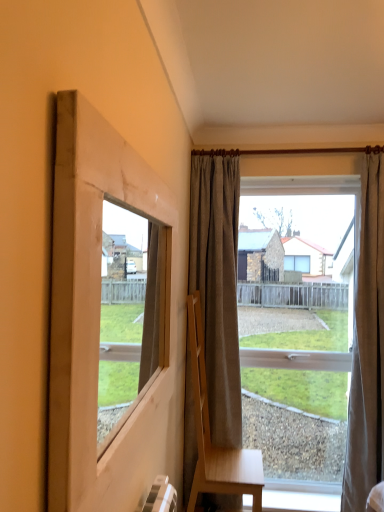
Question: Is clear glass window at center positioned in front of light brown wooden chair at center?

Choices:
 (A) yes
 (B) no

Answer: (B)

Question: From a real-world perspective, is clear glass window at center physically above light brown wooden chair at center?

Choices:
 (A) no
 (B) yes

Answer: (B)

Question: From the image's perspective, is clear glass window at center beneath light brown wooden chair at center?

Choices:
 (A) no
 (B) yes

Answer: (A)

Question: Could you tell me if clear glass window at center is facing light brown wooden chair at center?

Choices:
 (A) yes
 (B) no

Answer: (A)

Question: Does clear glass window at center have a larger size compared to light brown wooden chair at center?

Choices:
 (A) yes
 (B) no

Answer: (B)

Question: Does clear glass window at center have a lesser height compared to light brown wooden chair at center?

Choices:
 (A) yes
 (B) no

Answer: (B)

Question: Is the position of gray fabric curtain at center, the 2th curtain in the right-to-left sequence, less distant than that of light brown wooden chair at center?

Choices:
 (A) yes
 (B) no

Answer: (B)

Question: From a real-world perspective, is gray fabric curtain at center, which appears as the 1th curtain when viewed from the left, positioned over light brown wooden chair at center based on gravity?

Choices:
 (A) yes
 (B) no

Answer: (A)

Question: Can you confirm if gray fabric curtain at center, which appears as the 1th curtain when viewed from the left, is shorter than light brown wooden chair at center?

Choices:
 (A) yes
 (B) no

Answer: (B)

Question: From the image's perspective, is gray fabric curtain at center, the 2th curtain in the right-to-left sequence, beneath light brown wooden chair at center?

Choices:
 (A) yes
 (B) no

Answer: (B)

Question: Does gray fabric curtain at center, which appears as the 1th curtain when viewed from the left, have a larger size compared to light brown wooden chair at center?

Choices:
 (A) no
 (B) yes

Answer: (A)

Question: Can we say gray fabric curtain at center, which appears as the 1th curtain when viewed from the left, lies outside light brown wooden chair at center?

Choices:
 (A) yes
 (B) no

Answer: (A)

Question: From a real-world perspective, is gray fabric curtain at center, which appears as the 1th curtain when viewed from the left, under clear glass window at center?

Choices:
 (A) yes
 (B) no

Answer: (B)